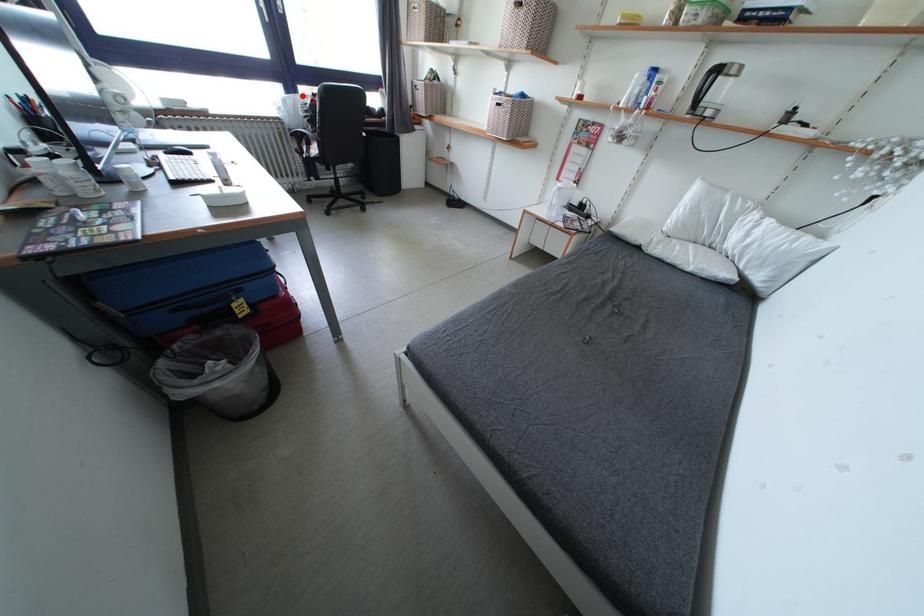
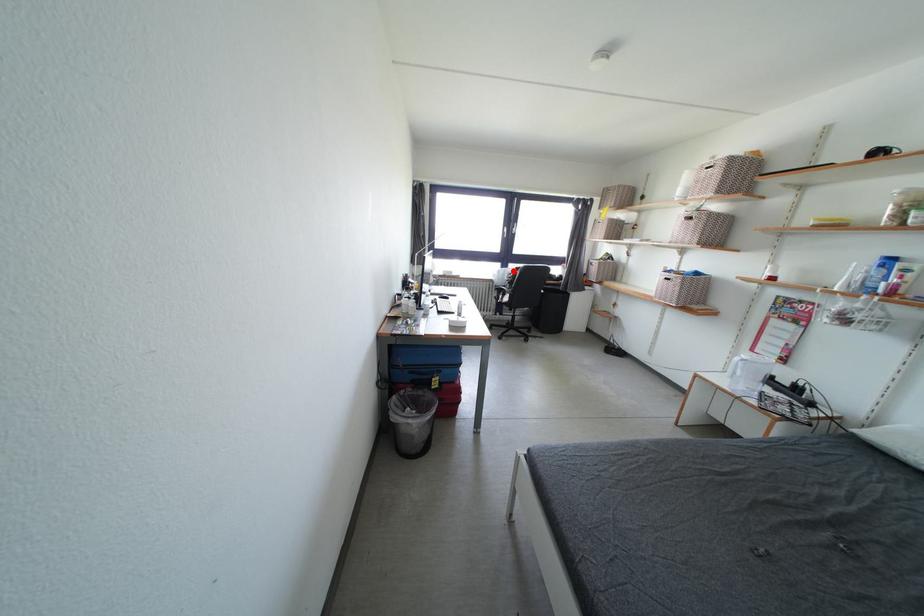
I am providing you with two images of the same scene from different viewpoints. A red point is marked on the first image and another point is marked on the second image. Is the marked point in image1 the same physical position as the marked point in image2?

Yes